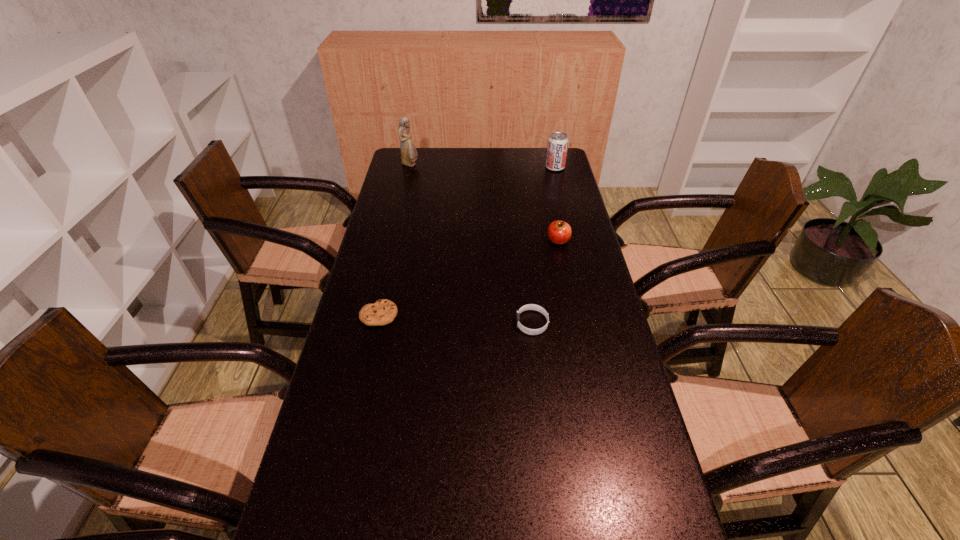
Where is `free space that satisfies the following two spatial constraints: 1. on the front-facing side of the tallest object; 2. on the right side of the shortest object`? This screenshot has width=960, height=540. free space that satisfies the following two spatial constraints: 1. on the front-facing side of the tallest object; 2. on the right side of the shortest object is located at coordinates (375, 315).

Where is `vacant point that satisfies the following two spatial constraints: 1. on the front-facing side of the cookie; 2. on the right side of the tallest object`? The height and width of the screenshot is (540, 960). vacant point that satisfies the following two spatial constraints: 1. on the front-facing side of the cookie; 2. on the right side of the tallest object is located at coordinates (375, 315).

Where is `blank area in the image that satisfies the following two spatial constraints: 1. on the front side of the third tallest object; 2. on the outer surface of the fourth tallest object`? blank area in the image that satisfies the following two spatial constraints: 1. on the front side of the third tallest object; 2. on the outer surface of the fourth tallest object is located at coordinates (576, 323).

Find the location of a particular element. The image size is (960, 540). vacant space that satisfies the following two spatial constraints: 1. on the front-facing side of the figurine; 2. on the right side of the soda can is located at coordinates (410, 167).